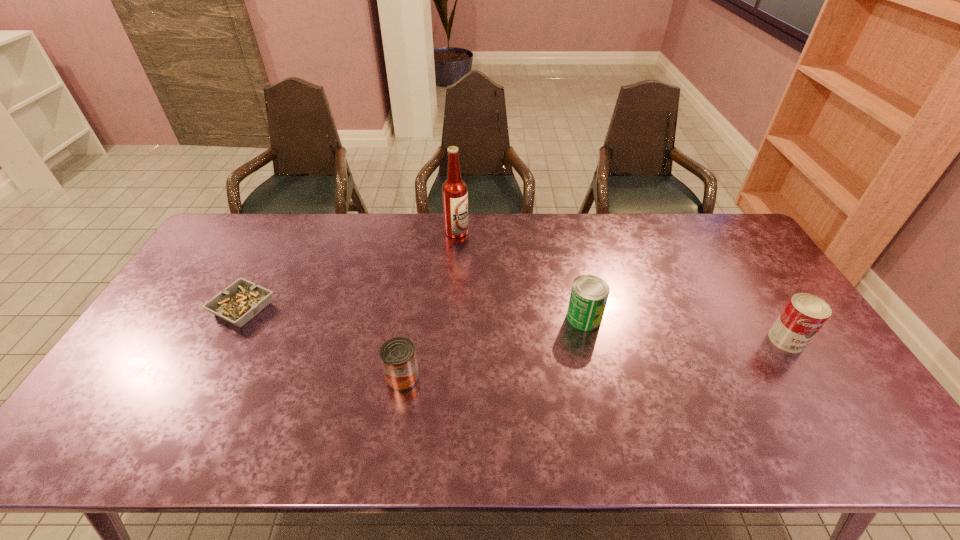
This screenshot has height=540, width=960. I want to click on vacant area at the far left corner of the desktop, so click(x=258, y=242).

This screenshot has height=540, width=960. Find the location of `free space at the near left corner of the desktop`. free space at the near left corner of the desktop is located at coordinates (127, 424).

The height and width of the screenshot is (540, 960). In the image, there is a desktop. In order to click on vacant area at the far right corner in this screenshot , I will do `click(714, 253)`.

Where is `free space between the shortest object and the second can from left to right`? This screenshot has height=540, width=960. free space between the shortest object and the second can from left to right is located at coordinates (414, 313).

You are a GUI agent. You are given a task and a screenshot of the screen. Output one action in this format:
    pyautogui.click(x=<x>, y=<y>)
    Task: Click on the free space between the tallest object and the leftmost can
    The width and height of the screenshot is (960, 540).
    Given the screenshot: What is the action you would take?
    pyautogui.click(x=430, y=305)

This screenshot has width=960, height=540. Find the location of `free space between the tallest object and the nearest can`. free space between the tallest object and the nearest can is located at coordinates (430, 305).

Locate an element on the screen. The height and width of the screenshot is (540, 960). free space between the nearest object and the rightmost object is located at coordinates (594, 359).

Where is `free space that is in between the second can from right to left and the ashtray`? free space that is in between the second can from right to left and the ashtray is located at coordinates (414, 313).

In order to click on free space between the third object from right to left and the nearest object in this screenshot , I will do `click(430, 305)`.

Locate an element on the screen. The height and width of the screenshot is (540, 960). vacant space in between the rightmost object and the third object from left to right is located at coordinates (621, 286).